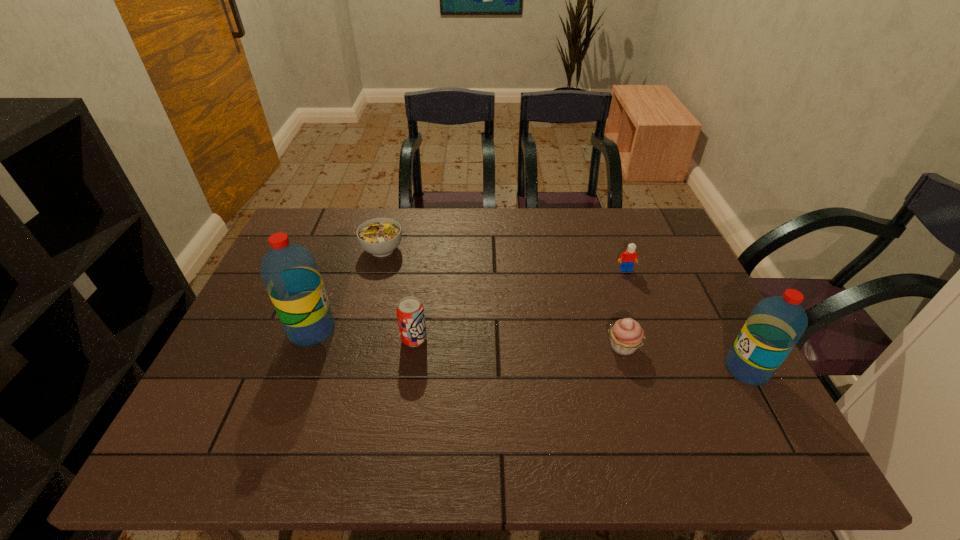
Where is `the second object from right to left`? the second object from right to left is located at coordinates (627, 259).

Locate an element on the screen. free space located on the front label of the taller water bottle is located at coordinates (373, 330).

Find the location of `vacant space located 0.080m on the front label of the right water bottle`. vacant space located 0.080m on the front label of the right water bottle is located at coordinates (692, 369).

The height and width of the screenshot is (540, 960). In order to click on free space located on the front label of the right water bottle in this screenshot , I will do pyautogui.click(x=696, y=369).

The height and width of the screenshot is (540, 960). Find the location of `vacant space located 0.370m on the front label of the right water bottle`. vacant space located 0.370m on the front label of the right water bottle is located at coordinates (570, 369).

The width and height of the screenshot is (960, 540). I want to click on vacant space located 0.170m on the left of the soup bowl, so click(307, 249).

Locate an element on the screen. vacant space located on the back of the cupcake is located at coordinates click(610, 303).

Image resolution: width=960 pixels, height=540 pixels. What are the coordinates of `free space located 0.170m on the left of the third object from left to right` in the screenshot? It's located at (334, 339).

I want to click on free region located 0.190m on the face of the Lego, so click(644, 319).

You are a GUI agent. You are given a task and a screenshot of the screen. Output one action in this format:
    pyautogui.click(x=<x>, y=<y>)
    Task: Click on the object that is at the far edge
    This screenshot has height=540, width=960.
    Given the screenshot: What is the action you would take?
    pyautogui.click(x=380, y=237)